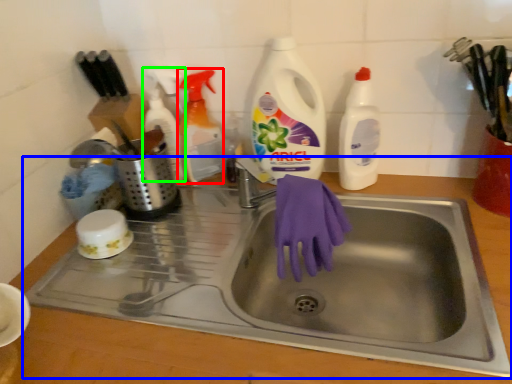
Question: Estimate the real-world distances between objects in this image. Which object is closer to cleaning product (highlighted by a red box), sink (highlighted by a blue box) or cleaning product (highlighted by a green box)?

Choices:
 (A) sink
 (B) cleaning product

Answer: (B)